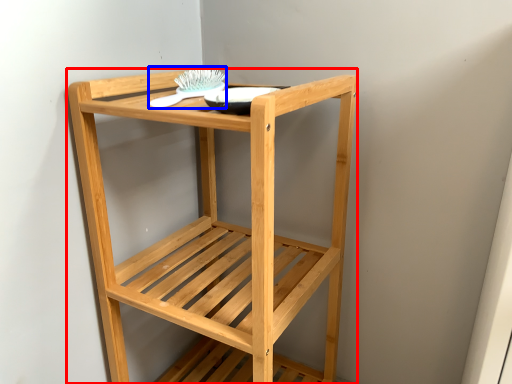
Question: Which of the following is the closest to the observer, furniture (highlighted by a red box) or brush (highlighted by a blue box)?

Choices:
 (A) furniture
 (B) brush

Answer: (A)